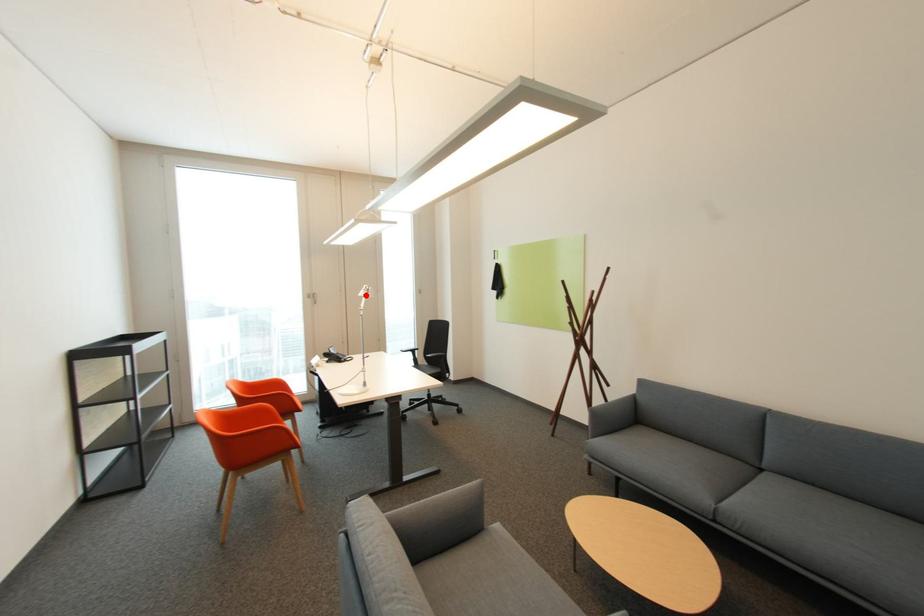
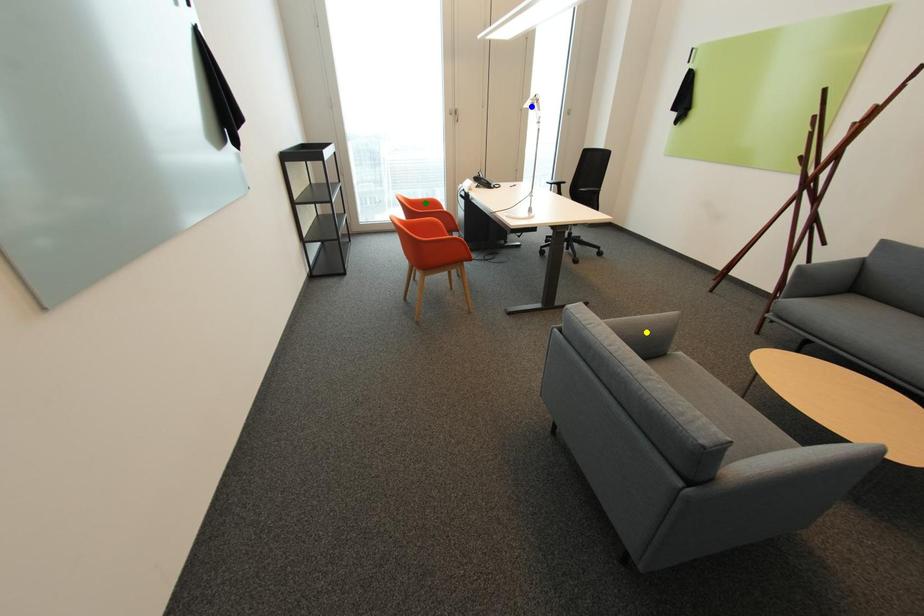
Question: I am providing you with two images of the same scene from different viewpoints. A red point is marked on the first image. You are given multiple points on the second image. In image 2, which mark is for the same physical point as the one in image 1?

Choices:
 (A) yellow point
 (B) green point
 (C) blue point

Answer: (C)